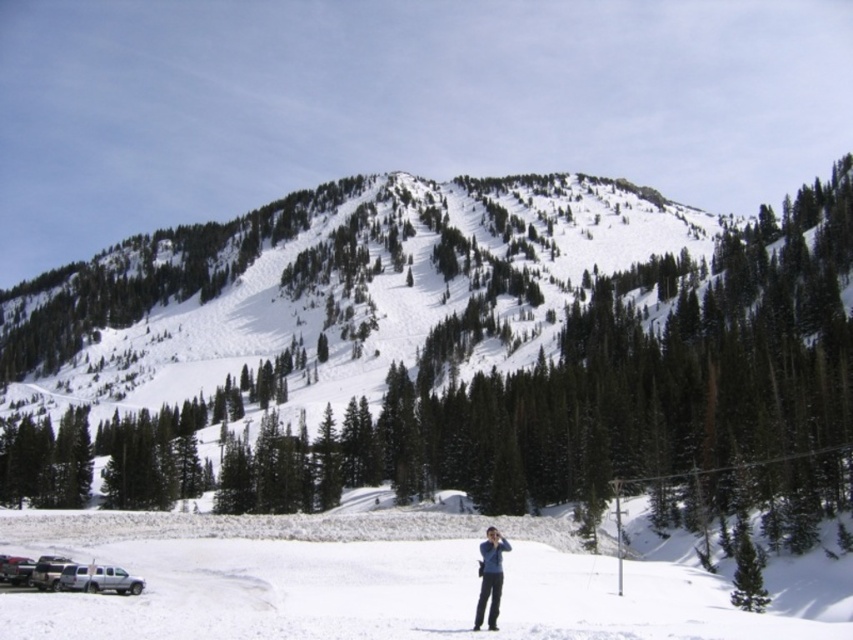
Which is above, white snow ski slope at lower center or blue fabric jacket at lower center?

blue fabric jacket at lower center

Does white snow ski slope at lower center appear under blue fabric jacket at lower center?

Indeed, white snow ski slope at lower center is positioned under blue fabric jacket at lower center.

Find the location of a particular element. This screenshot has width=853, height=640. white snow ski slope at lower center is located at coordinates (363, 580).